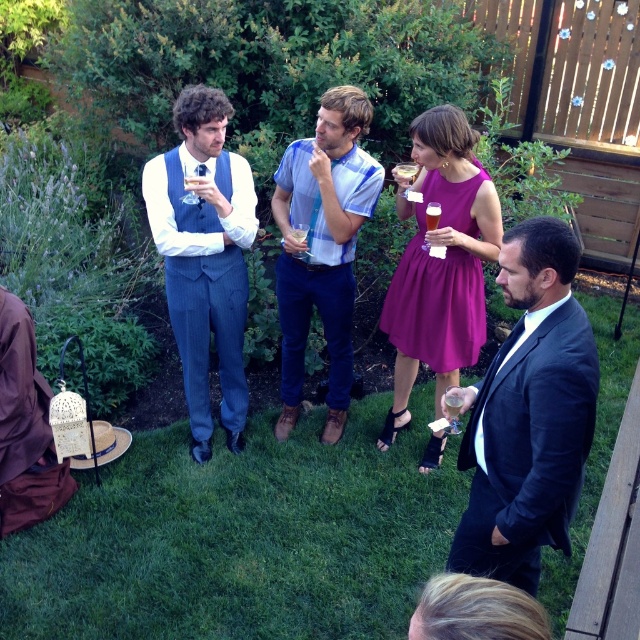
You are a photographer trying to capture a group photo of the dark suit at center and the blue striped shirt at center. Which one of them should you focus on first if you want to ensure both are in focus?

The dark suit at center is smaller than the blue striped shirt at center, so focusing on the dark suit at center first would help ensure both are in focus because smaller objects are easier to keep in focus when adjusting the camera settings.